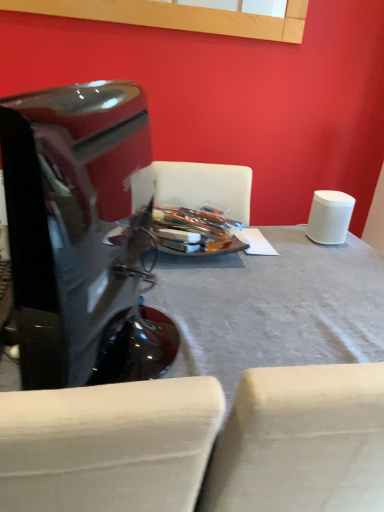
Question: Is white fabric table at center at the left side of glossy black monitor at left?

Choices:
 (A) no
 (B) yes

Answer: (A)

Question: Is white fabric table at center outside glossy black monitor at left?

Choices:
 (A) yes
 (B) no

Answer: (A)

Question: From the image's perspective, is white fabric table at center below glossy black monitor at left?

Choices:
 (A) no
 (B) yes

Answer: (B)

Question: Is white fabric table at center in front of glossy black monitor at left?

Choices:
 (A) yes
 (B) no

Answer: (B)

Question: Is white fabric table at center to the right of glossy black monitor at left from the viewer's perspective?

Choices:
 (A) no
 (B) yes

Answer: (B)

Question: Is white fabric table at center oriented towards glossy black monitor at left?

Choices:
 (A) no
 (B) yes

Answer: (A)

Question: Considering the relative sizes of glossy black monitor at left and white fabric table at center in the image provided, is glossy black monitor at left bigger than white fabric table at center?

Choices:
 (A) yes
 (B) no

Answer: (B)

Question: Is white fabric table at center completely or partially inside glossy black monitor at left?

Choices:
 (A) yes
 (B) no

Answer: (B)

Question: Is glossy black monitor at left at the right side of white fabric table at center?

Choices:
 (A) yes
 (B) no

Answer: (B)

Question: Are glossy black monitor at left and white fabric table at center far apart?

Choices:
 (A) no
 (B) yes

Answer: (A)

Question: Is glossy black monitor at left positioned before white fabric table at center?

Choices:
 (A) no
 (B) yes

Answer: (B)

Question: Considering the relative positions of glossy black monitor at left and white fabric table at center in the image provided, is glossy black monitor at left to the left of white fabric table at center from the viewer's perspective?

Choices:
 (A) yes
 (B) no

Answer: (A)

Question: Considering the relative positions of glossy black monitor at left and white fabric table at center in the image provided, is glossy black monitor at left to the left or to the right of white fabric table at center?

Choices:
 (A) right
 (B) left

Answer: (B)